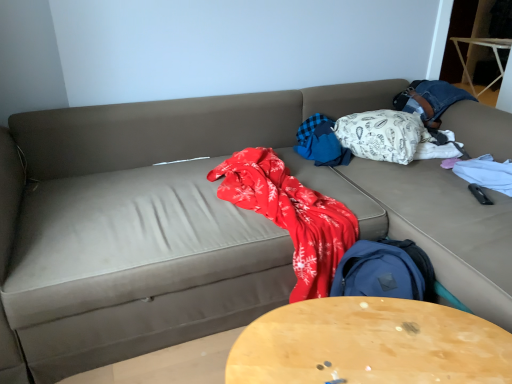
Question: Is white patterned fabric at upper right, acting as the second blanket starting from the left, wider or thinner than wooden round table at center?

Choices:
 (A) thin
 (B) wide

Answer: (B)

Question: Choose the correct answer: Is white patterned fabric at upper right, acting as the second blanket starting from the left, inside wooden round table at center or outside it?

Choices:
 (A) outside
 (B) inside

Answer: (A)

Question: Estimate the real-world distances between objects in this image. Which object is closer to the white patterned fabric at upper right, acting as the second blanket starting from the left?

Choices:
 (A) blue plaid blanket at center, which appears as the second blanket when viewed from the right
 (B) wooden round table at center

Answer: (A)

Question: Based on their relative distances, which object is nearer to the blue plaid blanket at center, which appears as the second blanket when viewed from the right?

Choices:
 (A) white patterned fabric at upper right, acting as the second blanket starting from the left
 (B) wooden round table at center

Answer: (A)